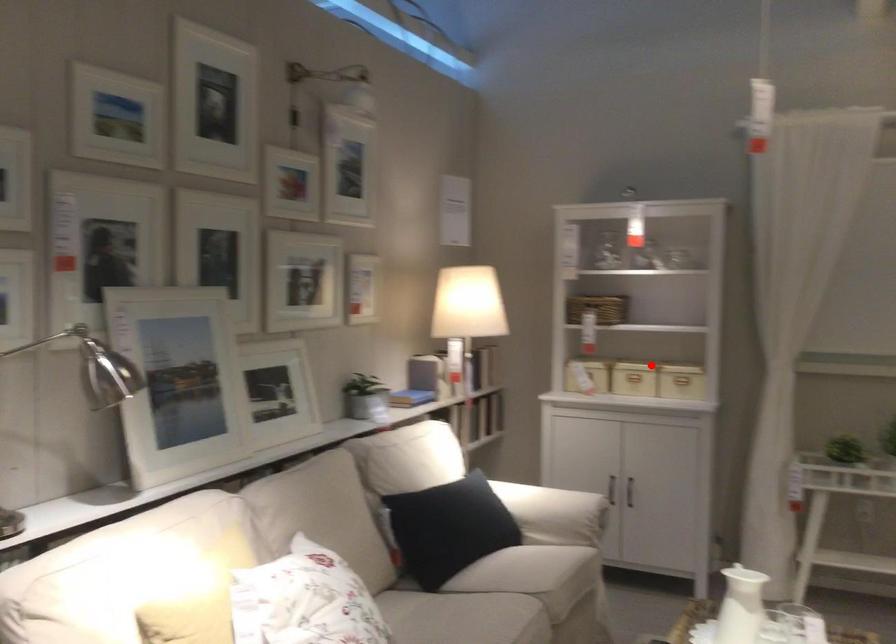
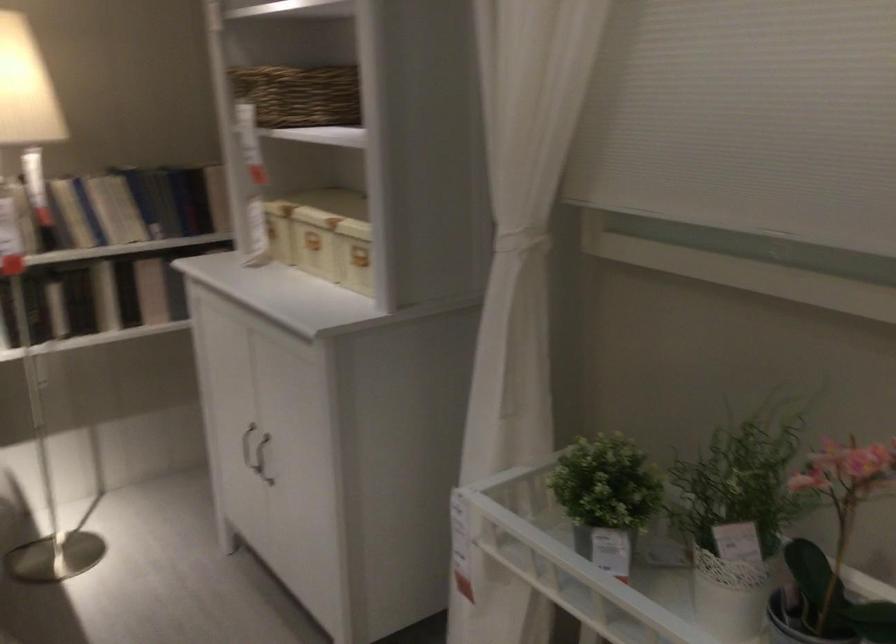
Where in the second image is the point corresponding to the highlighted location from the first image?

(314, 242)